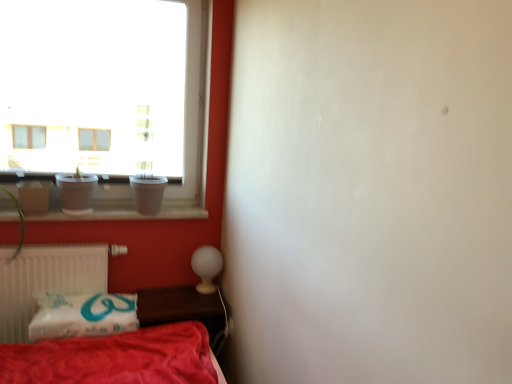
Where is `free space above wooden table at lower center (from a real-world perspective)`? This screenshot has width=512, height=384. free space above wooden table at lower center (from a real-world perspective) is located at coordinates (187, 301).